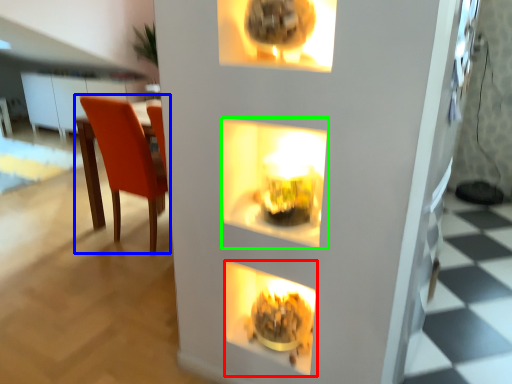
Question: Which object is the closest to the fireplace (highlighted by a red box)? Choose among these: chair (highlighted by a blue box) or shelf (highlighted by a green box).

Choices:
 (A) chair
 (B) shelf

Answer: (B)